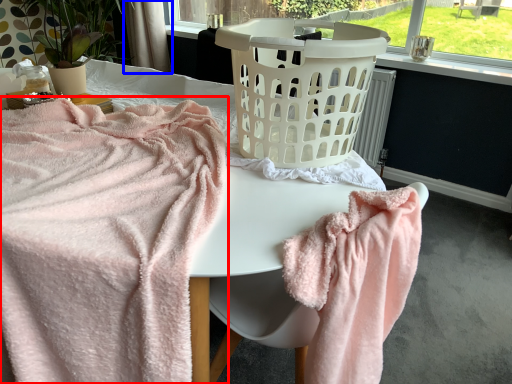
Question: Which object is further to the camera taking this photo, towel (highlighted by a red box) or curtain (highlighted by a blue box)?

Choices:
 (A) towel
 (B) curtain

Answer: (B)